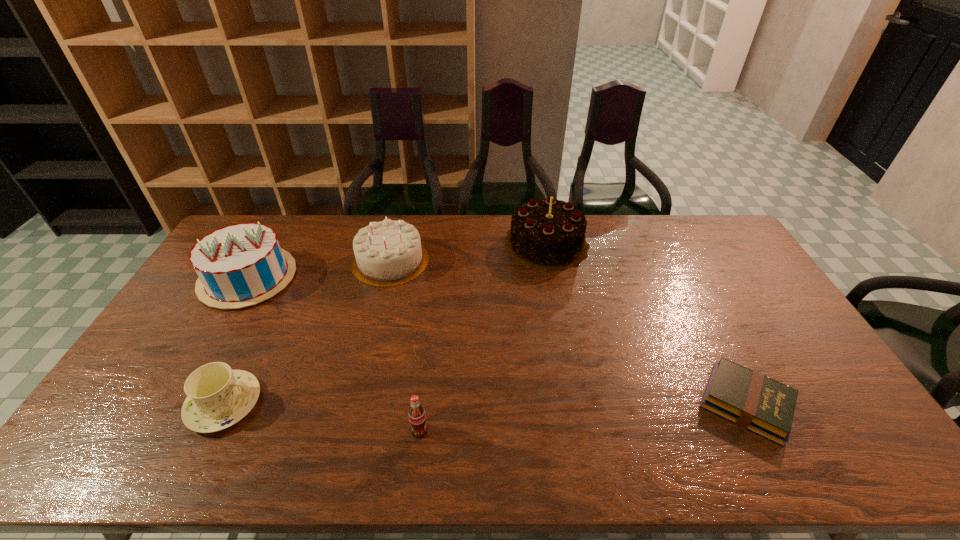
Where is `object located at the near right corner`? object located at the near right corner is located at coordinates (753, 401).

Find the location of a particular element. vacant space at the far edge of the desktop is located at coordinates (287, 238).

In the image, there is a desktop. Identify the location of free space at the near edge. The image size is (960, 540). (302, 464).

Locate an element on the screen. This screenshot has width=960, height=540. vacant space at the left edge is located at coordinates (144, 369).

In the image, there is a desktop. At what (x,y) coordinates should I click in order to perform the action: click on free space at the right edge. Please return your answer as a coordinate pair (x, y). Looking at the image, I should click on (737, 304).

This screenshot has width=960, height=540. I want to click on free space between the fourth object from left to right and the shortest object, so tap(583, 417).

Identify the location of free area in between the chinaware and the rightmost birthday cake. (385, 323).

This screenshot has height=540, width=960. Identify the location of empty space that is in between the fifth tallest object and the rightmost object. (485, 403).

Identify the location of vacant point located between the shortest birthday cake and the shortest object. (568, 332).

The image size is (960, 540). I want to click on vacant area that lies between the shortest birthday cake and the fifth tallest object, so click(307, 332).